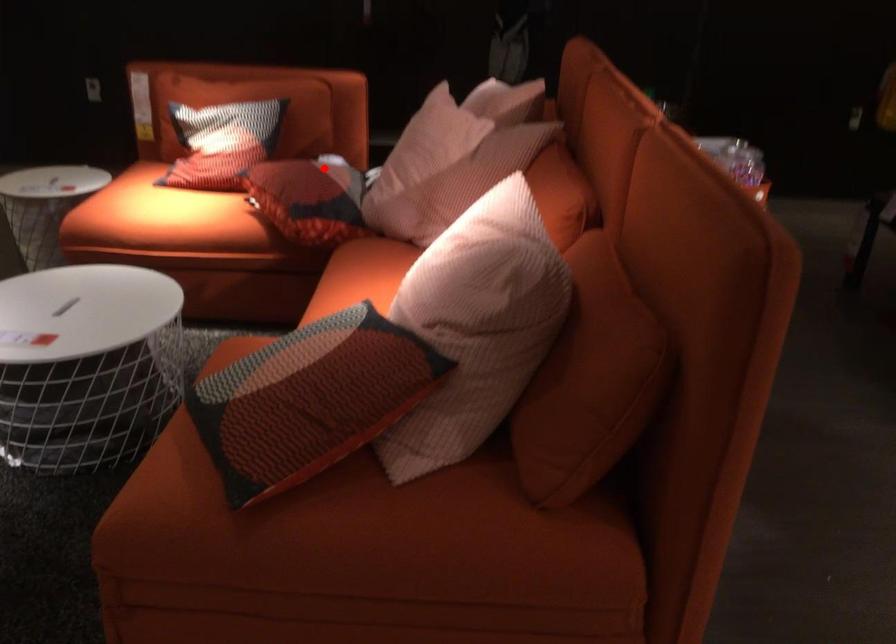
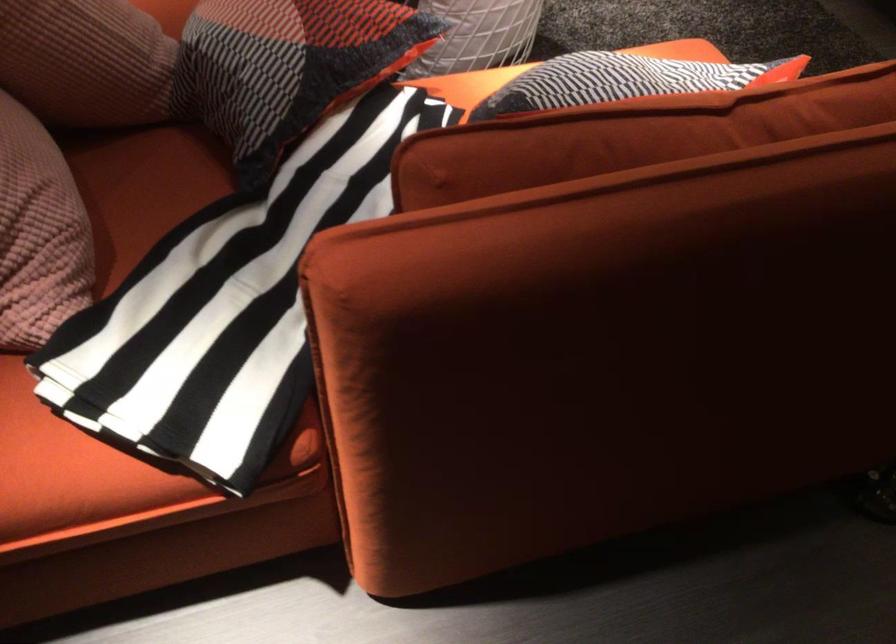
Question: I am providing you with two images of the same scene from different viewpoints. Image1 has a red point marked. In image2, the corresponding 3D location appears at what relative position? Reply with the corresponding letter.

Choices:
 (A) Closer
 (B) Farther

Answer: (A)